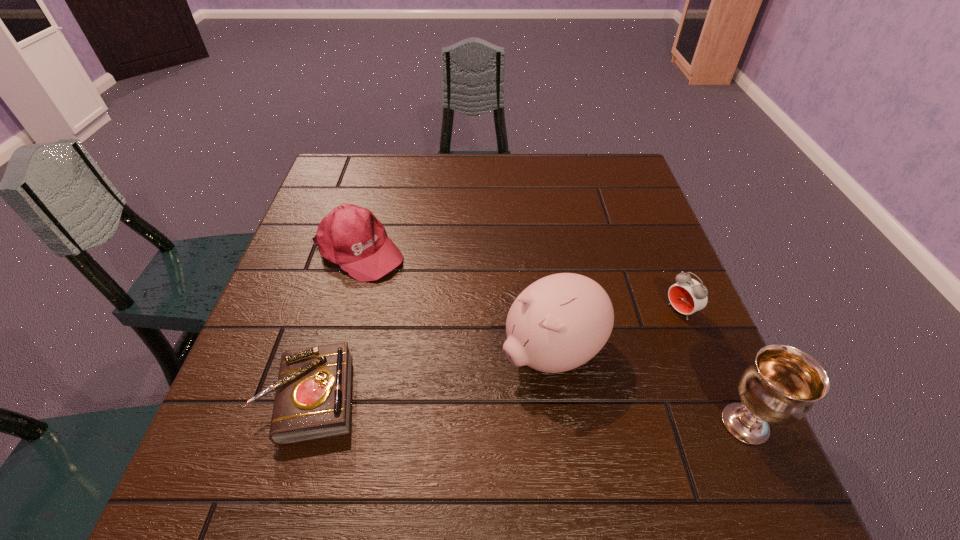
Identify the location of free space located at the snout of the piggy bank. This screenshot has height=540, width=960. (475, 396).

Locate an element on the screen. vacant space located at the snout of the piggy bank is located at coordinates (489, 388).

Where is `vacant space positioned 0.310m on the face of the alarm clock`? This screenshot has height=540, width=960. vacant space positioned 0.310m on the face of the alarm clock is located at coordinates (554, 384).

The image size is (960, 540). I want to click on blank area located 0.110m on the face of the alarm clock, so click(632, 340).

Locate an element on the screen. Image resolution: width=960 pixels, height=540 pixels. free region located 0.190m on the face of the alarm clock is located at coordinates click(602, 356).

Image resolution: width=960 pixels, height=540 pixels. Find the location of `diary located in the near edge section of the desktop`. diary located in the near edge section of the desktop is located at coordinates (313, 393).

I want to click on chalice that is at the near edge, so click(781, 385).

The image size is (960, 540). Find the location of `piggy bank located in the near edge section of the desktop`. piggy bank located in the near edge section of the desktop is located at coordinates (558, 323).

Image resolution: width=960 pixels, height=540 pixels. Find the location of `diary that is at the left edge`. diary that is at the left edge is located at coordinates (313, 393).

The height and width of the screenshot is (540, 960). Identify the location of baseball cap that is at the left edge. (350, 236).